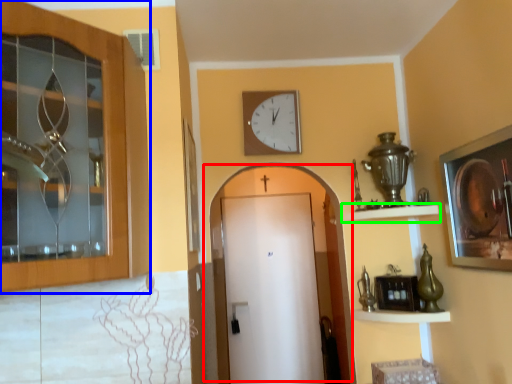
Question: Estimate the real-world distances between objects in this image. Which object is closer to door (highlighted by a red box), door (highlighted by a blue box) or shelf (highlighted by a green box)?

Choices:
 (A) door
 (B) shelf

Answer: (B)